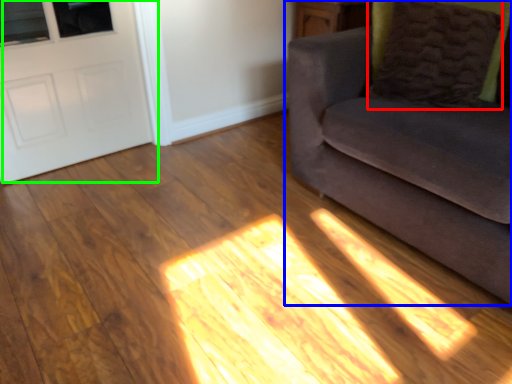
Question: Estimate the real-world distances between objects in this image. Which object is farther from pillow (highlighted by a red box), studio couch (highlighted by a blue box) or door (highlighted by a green box)?

Choices:
 (A) studio couch
 (B) door

Answer: (B)